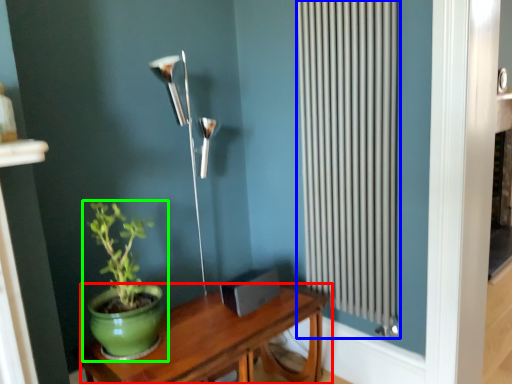
Question: Based on their relative distances, which object is farther from table (highlighted by a red box)? Choose from radiator (highlighted by a blue box) and houseplant (highlighted by a green box).

Choices:
 (A) radiator
 (B) houseplant

Answer: (A)